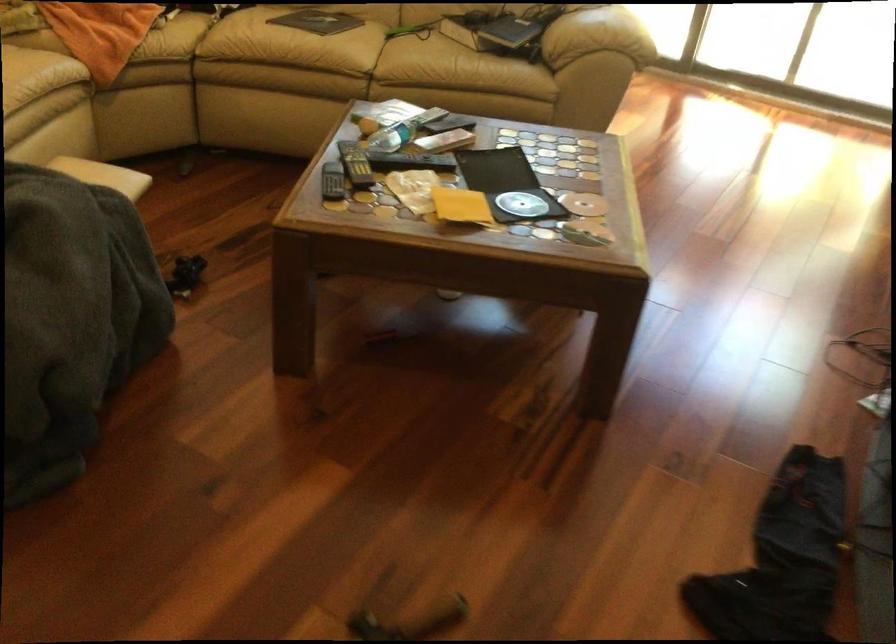
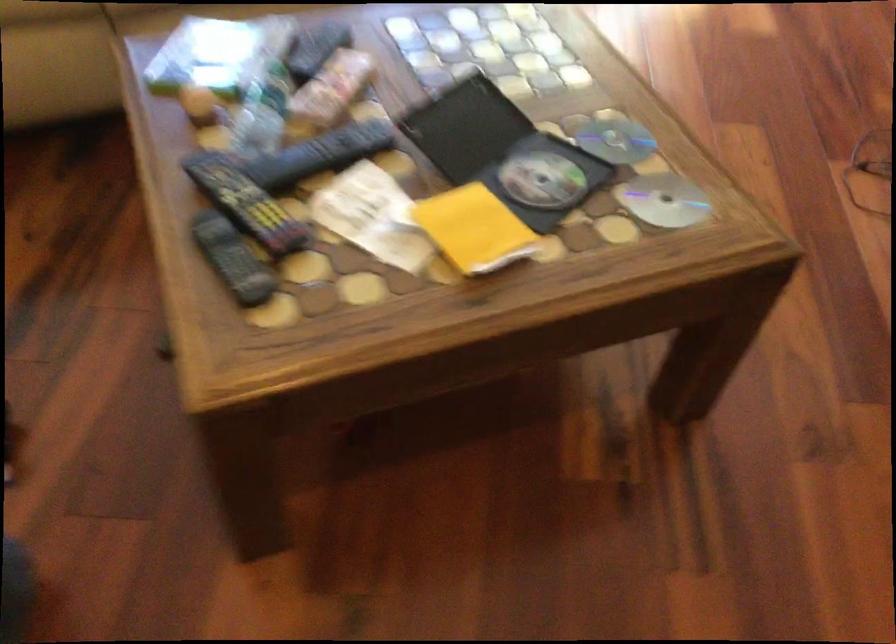
Where in the second image is the point corresponding to pixel 351 161 from the first image?

(245, 202)